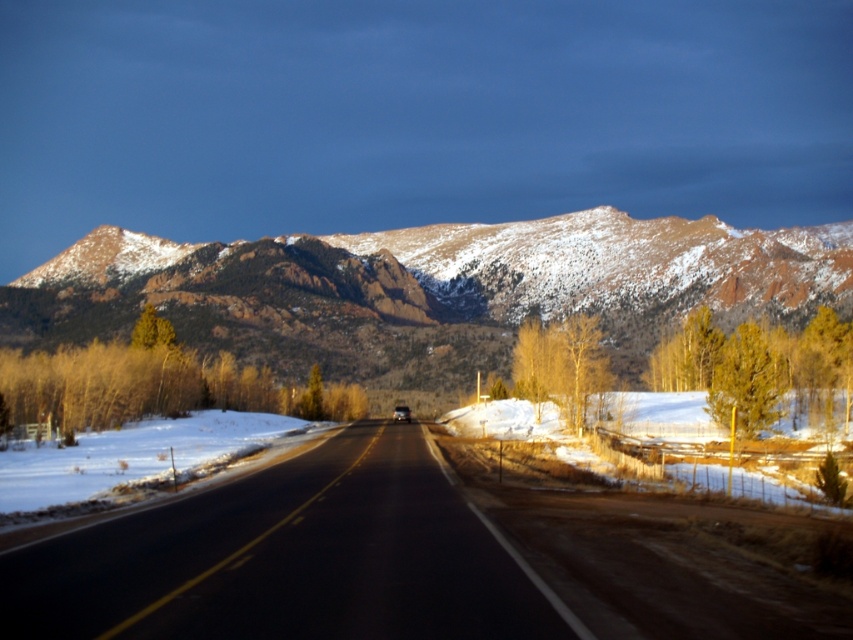
Does point (370, 241) come closer to viewer compared to point (311, 604)?

No, (370, 241) is further to viewer.

Can you confirm if snow-covered rock at upper center is thinner than black asphalt road at center?

No, snow-covered rock at upper center is not thinner than black asphalt road at center.

Where is `snow-covered rock at upper center`? snow-covered rock at upper center is located at coordinates (427, 288).

Locate an element on the screen. snow-covered rock at upper center is located at coordinates (427, 288).

Does snow-covered rock at upper center have a larger size compared to metallic silver car at center?

Correct, snow-covered rock at upper center is larger in size than metallic silver car at center.

Locate an element on the screen. snow-covered rock at upper center is located at coordinates (427, 288).

Is black asphalt road at center smaller than metallic silver car at center?

Actually, black asphalt road at center might be larger than metallic silver car at center.

Between point (413, 572) and point (392, 416), which one is positioned behind?

Positioned behind is point (392, 416).

Is point (91, 634) farther from viewer compared to point (405, 420)?

That is False.

Locate an element on the screen. Image resolution: width=853 pixels, height=640 pixels. black asphalt road at center is located at coordinates (291, 560).